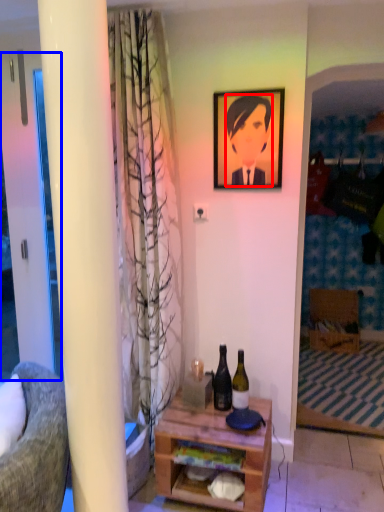
Question: Which of the following is the farthest to the observer, person (highlighted by a red box) or screen door (highlighted by a blue box)?

Choices:
 (A) person
 (B) screen door

Answer: (B)